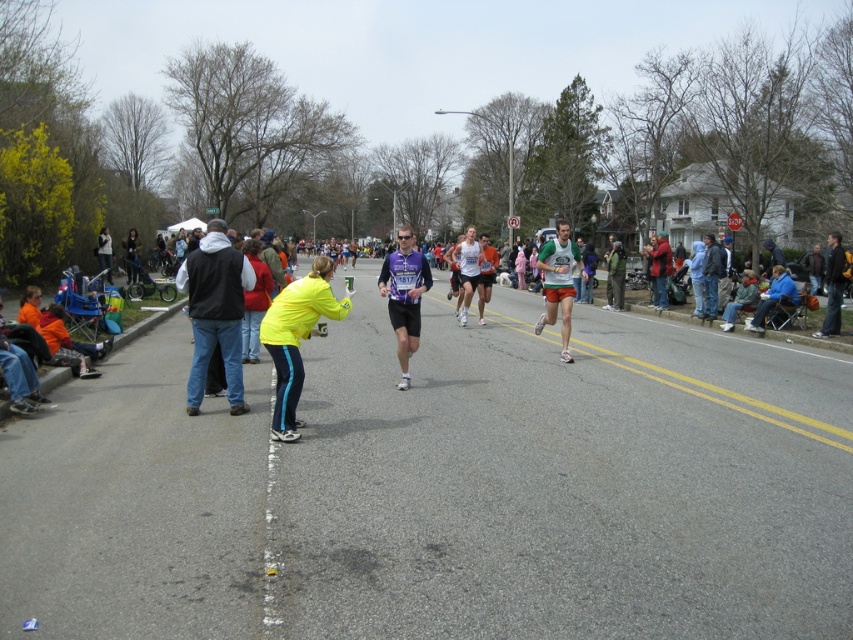
You are a photographer at the marathon event. You want to take a photo that includes both the black vest at center and green fabric shorts at center. Which object should you focus on first to ensure both are in frame?

The black vest at center is much taller than the green fabric shorts at center, so you should focus on the black vest at center first to ensure both are in frame.

You are a photographer positioned at the starting line of the marathon. You want to capture a photo of the two runners wearing the matte black jacket at center and the yellow fabric jacket at center. Which runner should you focus on first to ensure both are in the frame?

The yellow fabric jacket at center is to the left of the matte black jacket at center, so you should focus on the yellow fabric jacket at center first to ensure both are in the frame.

You are a photographer positioned at the starting line of the marathon. You want to capture a photo of both the matte black jacket at center and the yellow fabric jacket at center. Which jacket should you adjust your camera focus to first if you want to ensure both are in the frame?

The matte black jacket at center is below the yellow fabric jacket at center, so you should focus on the yellow fabric jacket at center first to ensure both are in the frame.